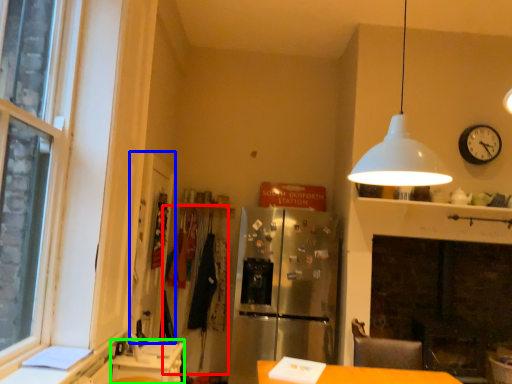
Question: Which object is positioned farthest from laundry (highlighted by a red box)? Select from glass door (highlighted by a blue box) and counter (highlighted by a green box).

Choices:
 (A) glass door
 (B) counter

Answer: (B)